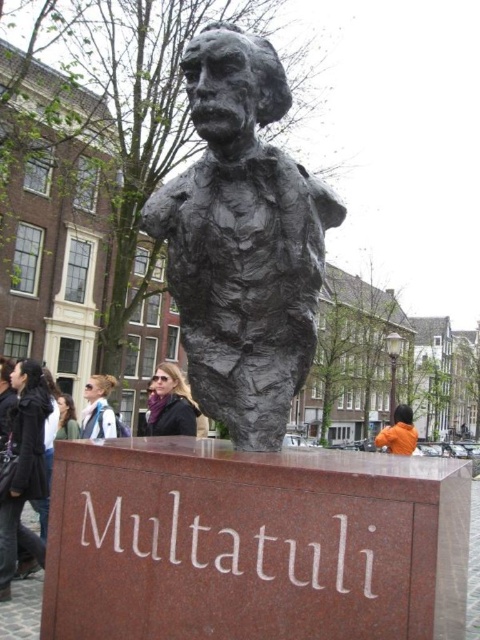
Based on the photo, you are an artist planning to sketch this scene. You need to decide which object to focus on first based on their sizes. Which object should you sketch first, the black bronze bust at center or the orange fabric jacket at lower right?

The orange fabric jacket at lower right is larger than the black bronze bust at center, so you should sketch the orange fabric jacket at lower right first.

You are an artist planning to paint the statue and its surroundings. You notice two jackets in the scene. Which jacket, the matte black jacket at center or the orange fabric jacket at lower right, is narrower in width?

The matte black jacket at center is narrower in width compared to the orange fabric jacket at lower right.

You are standing in front of the statue and want to take a photo of the black bronze bust at center. If your camera has a maximum focus range of 3.5 meters, will you be able to capture the bust clearly?

The black bronze bust at center is 3.78 meters away from camera, which is beyond the camera maximum focus range of 3.5 meters. So you cannot capture the bust clearly.